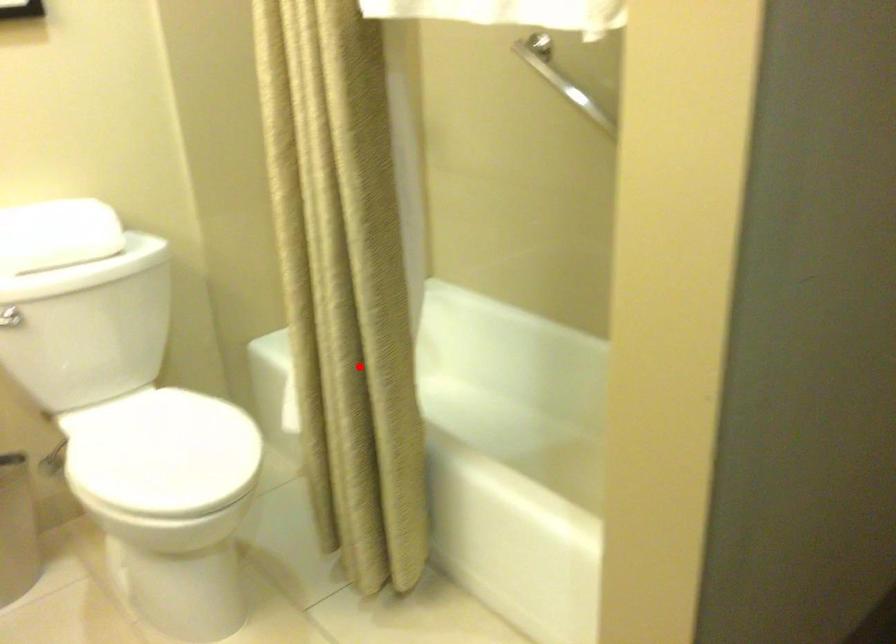
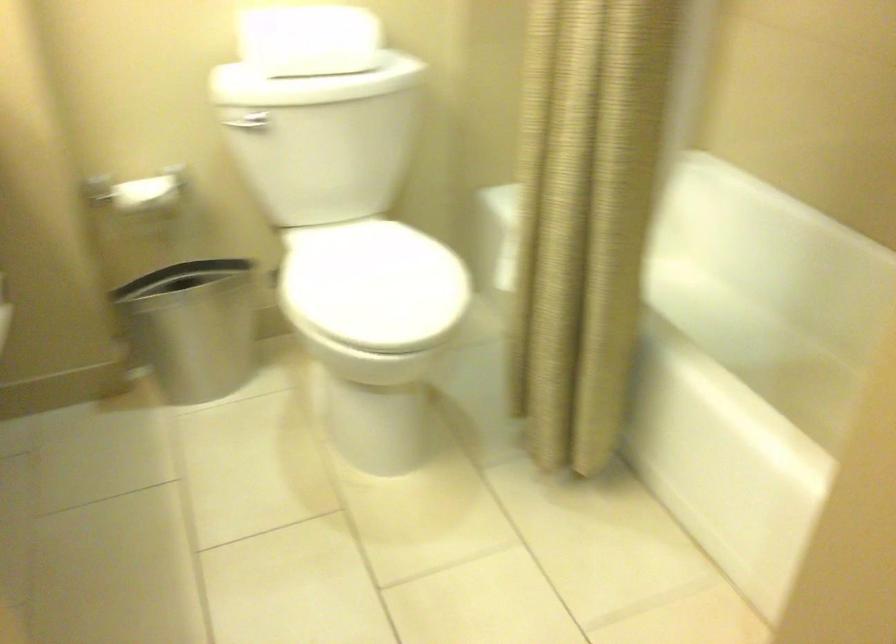
Locate, in the second image, the point that corresponds to the highlighted location in the first image.

(583, 230)